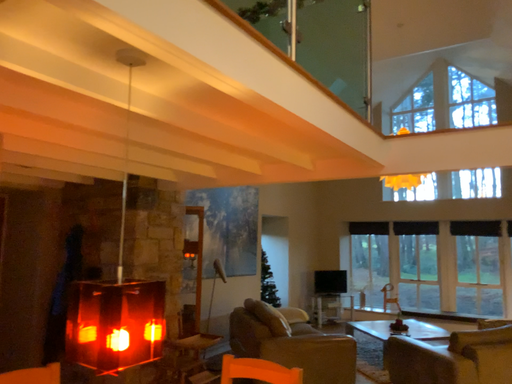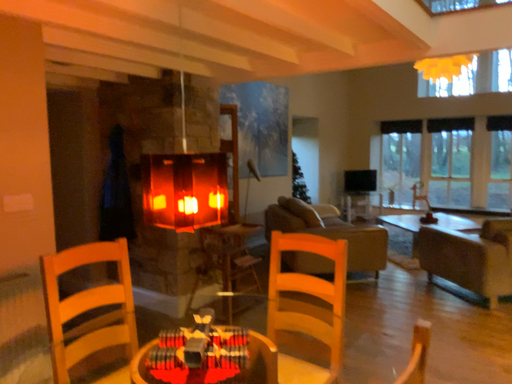
Question: How did the camera likely rotate when shooting the video?

Choices:
 (A) rotated downward
 (B) rotated upward

Answer: (A)